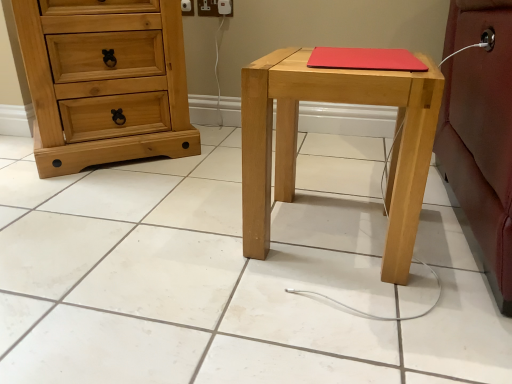
The height and width of the screenshot is (384, 512). Find the location of `vacant space underneath natural wood stool at center (from a real-world perspective)`. vacant space underneath natural wood stool at center (from a real-world perspective) is located at coordinates (327, 231).